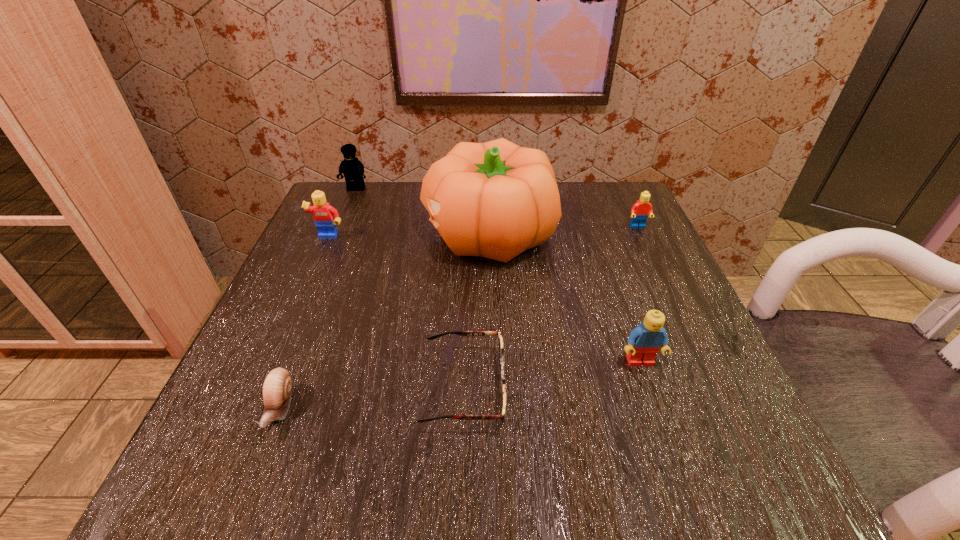
You are a GUI agent. You are given a task and a screenshot of the screen. Output one action in this format:
    pyautogui.click(x=<x>, y=<y>)
    Task: Click on the escargot located at the left edge
    The width and height of the screenshot is (960, 540).
    Given the screenshot: What is the action you would take?
    pyautogui.click(x=277, y=386)

Identify the location of object located in the near left corner section of the desktop. (277, 386).

You are a GUI agent. You are given a task and a screenshot of the screen. Output one action in this format:
    pyautogui.click(x=<x>, y=<y>)
    Task: Click on the object present at the far right corner
    This screenshot has height=540, width=960.
    Given the screenshot: What is the action you would take?
    pyautogui.click(x=639, y=212)

The image size is (960, 540). I want to click on free region at the far edge of the desktop, so click(x=409, y=207).

Find the location of `free space at the near edge of the desktop`. free space at the near edge of the desktop is located at coordinates (609, 458).

What are the coordinates of `vacant space at the left edge of the desktop` in the screenshot? It's located at (301, 348).

This screenshot has width=960, height=540. I want to click on vacant space at the right edge of the desktop, so click(610, 251).

Where is `free space at the near left corner`? The width and height of the screenshot is (960, 540). free space at the near left corner is located at coordinates (247, 476).

The width and height of the screenshot is (960, 540). In the image, there is a desktop. In order to click on free space at the far right corner in this screenshot , I will do `click(622, 236)`.

Find the location of `vacant space at the near right corner`. vacant space at the near right corner is located at coordinates (732, 456).